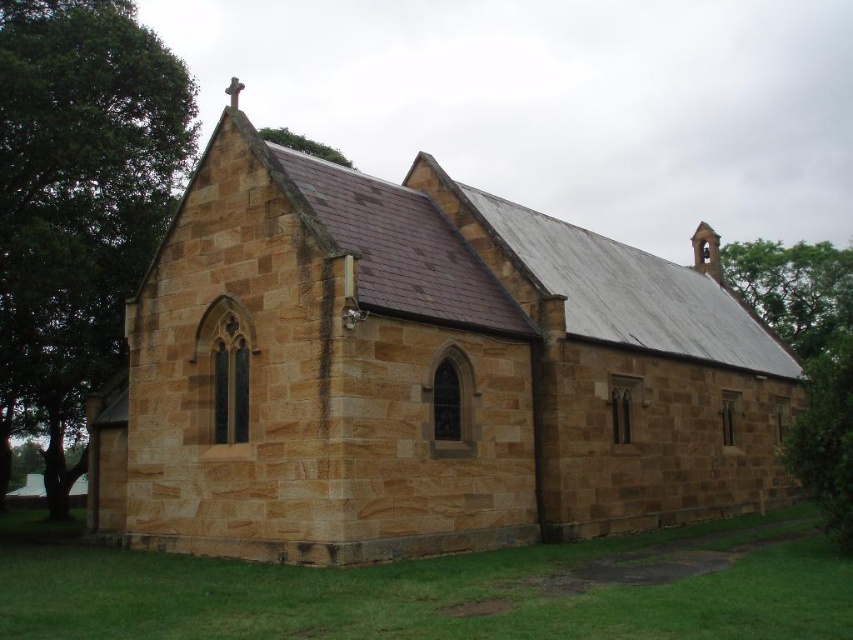
Is green leafy tree at left thinner than green leafy tree at upper right?

Indeed, green leafy tree at left has a lesser width compared to green leafy tree at upper right.

Image resolution: width=853 pixels, height=640 pixels. What are the coordinates of `green leafy tree at left` in the screenshot? It's located at (77, 204).

The height and width of the screenshot is (640, 853). What do you see at coordinates (77, 204) in the screenshot?
I see `green leafy tree at left` at bounding box center [77, 204].

Where is `green leafy tree at left`? green leafy tree at left is located at coordinates (77, 204).

Who is positioned more to the right, brown stone church at center or green leafy tree at upper center?

brown stone church at center

Does brown stone church at center have a greater height compared to green leafy tree at upper center?

No.

Who is more distant from viewer, (520, 208) or (331, 148)?

The point (331, 148) is behind.

What are the coordinates of `brown stone church at center` in the screenshot? It's located at (421, 372).

The height and width of the screenshot is (640, 853). What do you see at coordinates (808, 358) in the screenshot?
I see `green leafy tree at upper right` at bounding box center [808, 358].

Between green leafy tree at upper right and green leafy tree at upper center, which one appears on the left side from the viewer's perspective?

From the viewer's perspective, green leafy tree at upper center appears more on the left side.

Where is `green leafy tree at upper right`? green leafy tree at upper right is located at coordinates (808, 358).